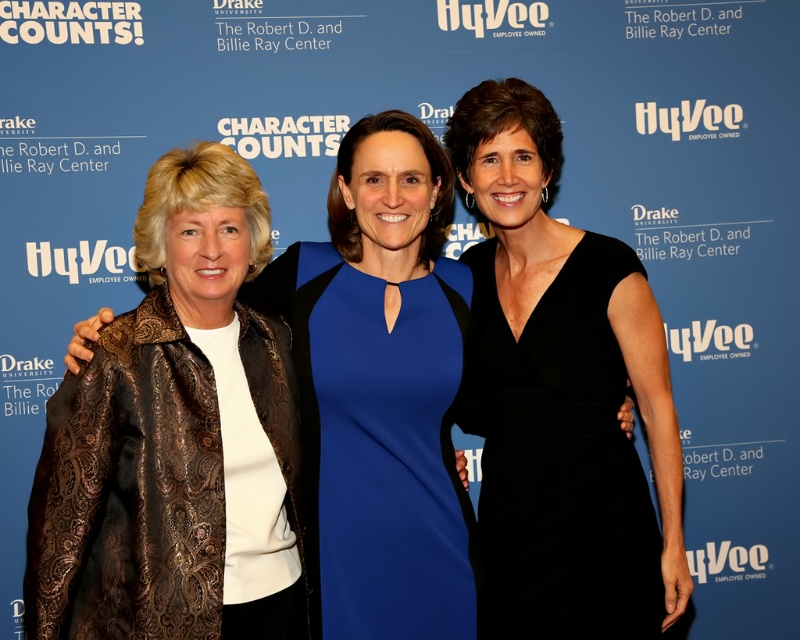
Is black satin dress at center positioned in front of bronze textured jacket at left?

No, it is behind bronze textured jacket at left.

Which is in front, point (621, 484) or point (346, 403)?

Point (346, 403) is in front.

Is point (472, 337) behind point (440, 160)?

Yes, point (472, 337) is behind point (440, 160).

Locate an element on the screen. black satin dress at center is located at coordinates (562, 396).